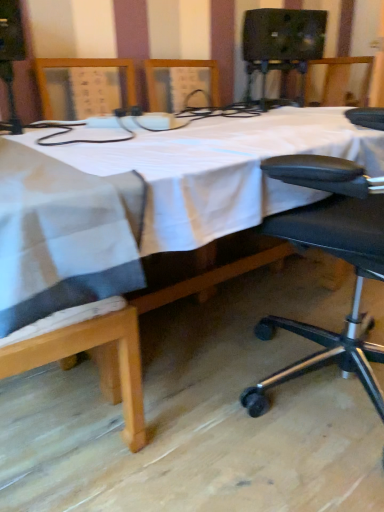
Question: Is black fabric chair at lower right looking in the opposite direction of white cloth-covered table at center?

Choices:
 (A) no
 (B) yes

Answer: (A)

Question: Does black fabric chair at lower right lie behind white cloth-covered table at center?

Choices:
 (A) no
 (B) yes

Answer: (B)

Question: Can you confirm if black fabric chair at lower right is wider than white cloth-covered table at center?

Choices:
 (A) yes
 (B) no

Answer: (B)

Question: From the image's perspective, is black fabric chair at lower right beneath white cloth-covered table at center?

Choices:
 (A) no
 (B) yes

Answer: (B)

Question: From a real-world perspective, is black fabric chair at lower right under white cloth-covered table at center?

Choices:
 (A) no
 (B) yes

Answer: (A)

Question: Are black fabric chair at lower right and white cloth-covered table at center located far from each other?

Choices:
 (A) no
 (B) yes

Answer: (A)

Question: Is white cloth-covered table at center positioned far away from black fabric chair at lower right?

Choices:
 (A) no
 (B) yes

Answer: (A)

Question: Is white cloth-covered table at center thinner than black fabric chair at lower right?

Choices:
 (A) yes
 (B) no

Answer: (B)

Question: Considering the relative sizes of white cloth-covered table at center and black fabric chair at lower right in the image provided, is white cloth-covered table at center smaller than black fabric chair at lower right?

Choices:
 (A) yes
 (B) no

Answer: (B)

Question: From a real-world perspective, is white cloth-covered table at center physically below black fabric chair at lower right?

Choices:
 (A) yes
 (B) no

Answer: (A)

Question: Considering the relative sizes of white cloth-covered table at center and black fabric chair at lower right in the image provided, is white cloth-covered table at center taller than black fabric chair at lower right?

Choices:
 (A) yes
 (B) no

Answer: (B)

Question: Is white cloth-covered table at center wider than black fabric chair at lower right?

Choices:
 (A) no
 (B) yes

Answer: (B)

Question: From the image's perspective, is white cloth-covered table at center positioned above or below black fabric chair at lower right?

Choices:
 (A) below
 (B) above

Answer: (B)